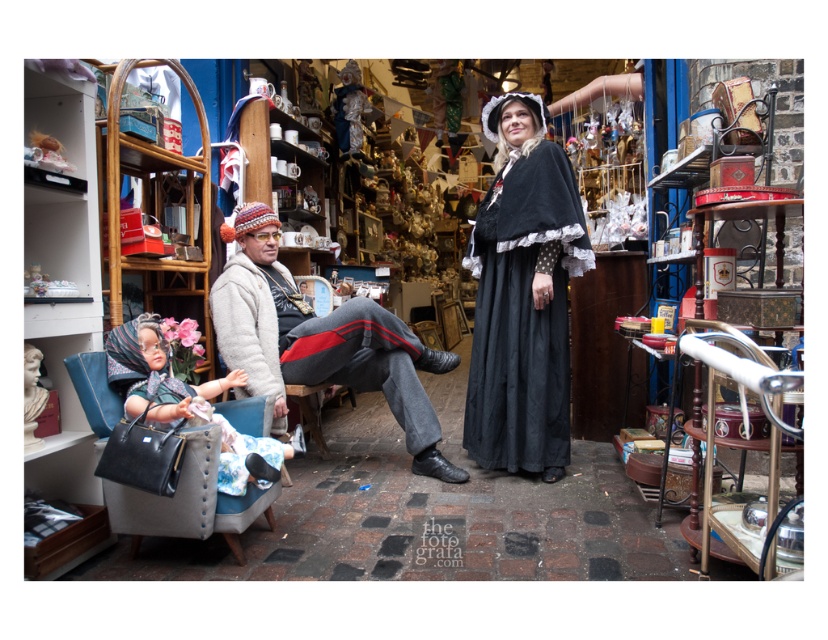
You are a delivery person who needs to place a large package on the floor between the leather armchair at left and the camera. The package is 1.8 meters long. Will it fit in that space?

The space between the leather armchair at left and the camera is 1.72 meters, which is shorter than the 1.8 meter package. The package won